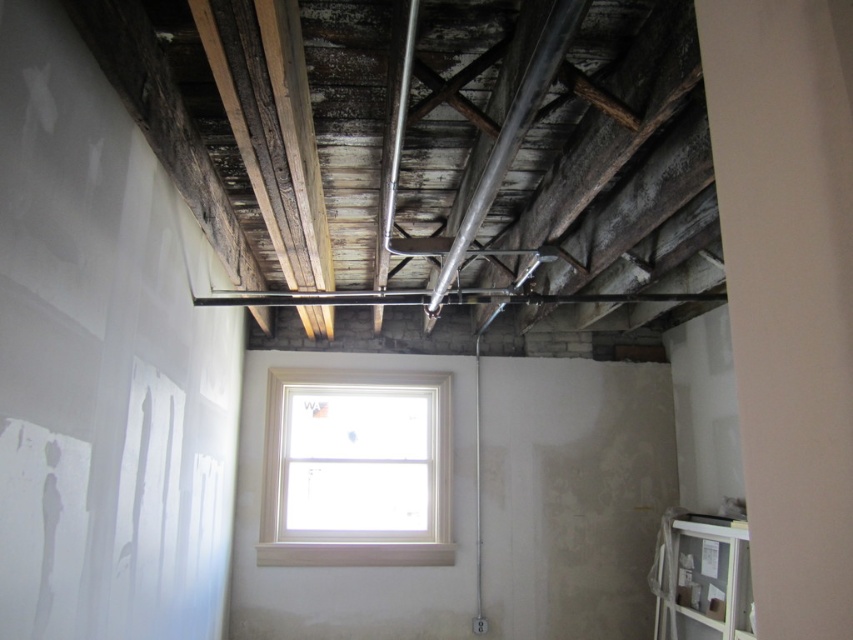
Question: Estimate the real-world distances between objects in this image. Which object is closer to the metallic pipe at upper center?

Choices:
 (A) white painted wood window at center
 (B) matte silver pipe at center

Answer: (A)

Question: Can you confirm if white painted wood window at center is positioned to the left of matte silver pipe at center?

Choices:
 (A) yes
 (B) no

Answer: (A)

Question: Considering the real-world distances, which object is closest to the metallic pipe at upper center?

Choices:
 (A) white painted wood window at center
 (B) matte silver pipe at center

Answer: (A)

Question: Is metallic pipe at upper center bigger than matte silver pipe at center?

Choices:
 (A) yes
 (B) no

Answer: (A)

Question: Which of the following is the farthest from the observer?

Choices:
 (A) (479, 426)
 (B) (495, 147)

Answer: (A)

Question: Is white painted wood window at center above metallic pipe at upper center?

Choices:
 (A) no
 (B) yes

Answer: (A)